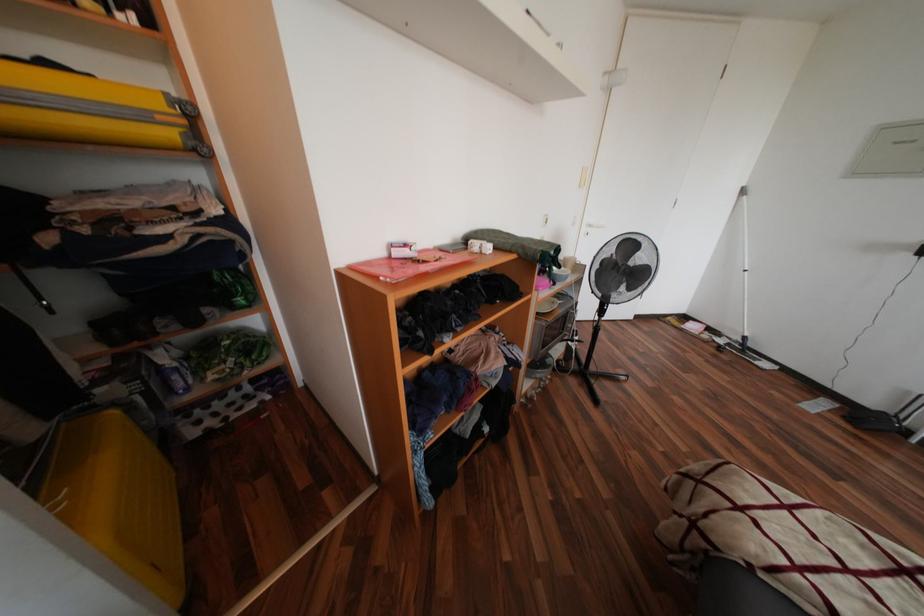
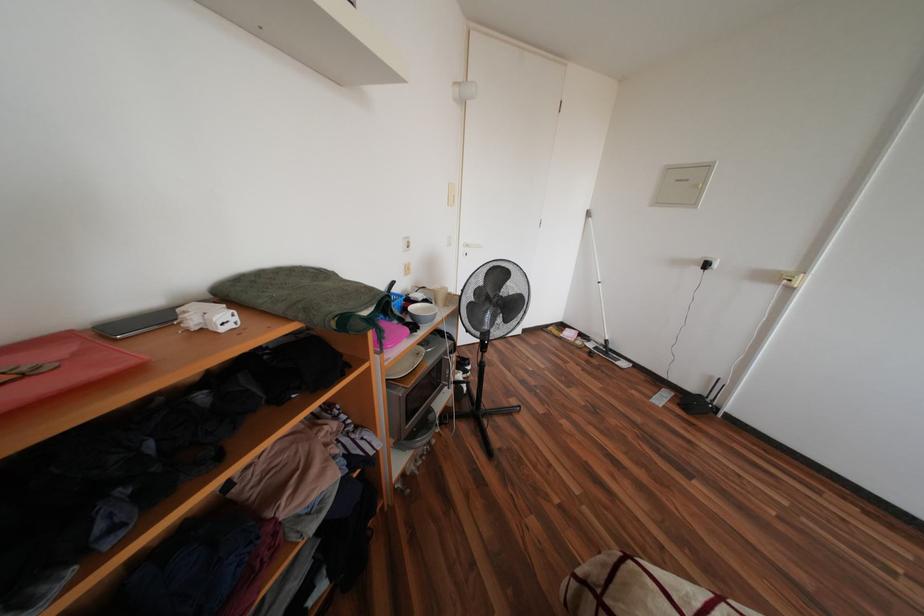
The images are taken continuously from a first-person perspective. In which direction are you moving?

The cameraman walked toward right, forward.